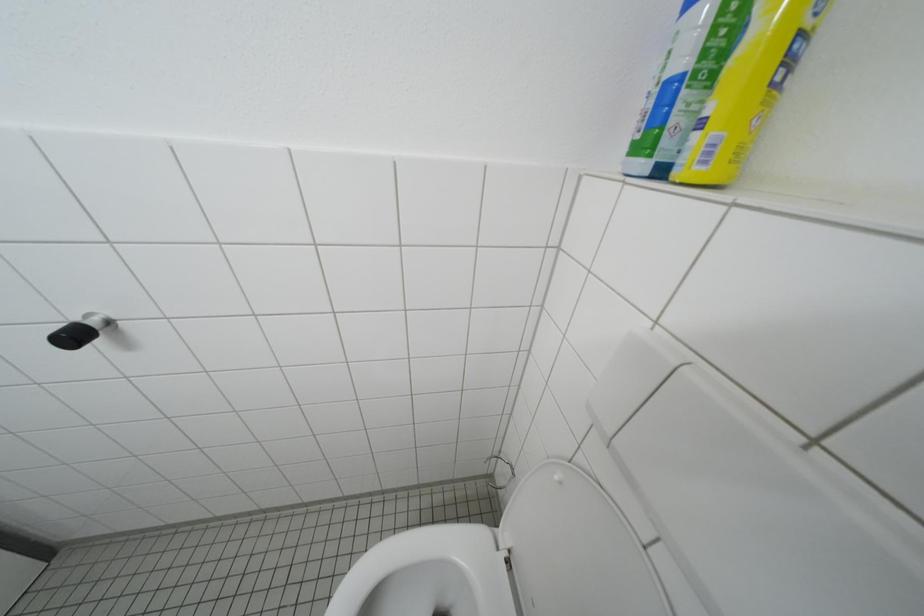
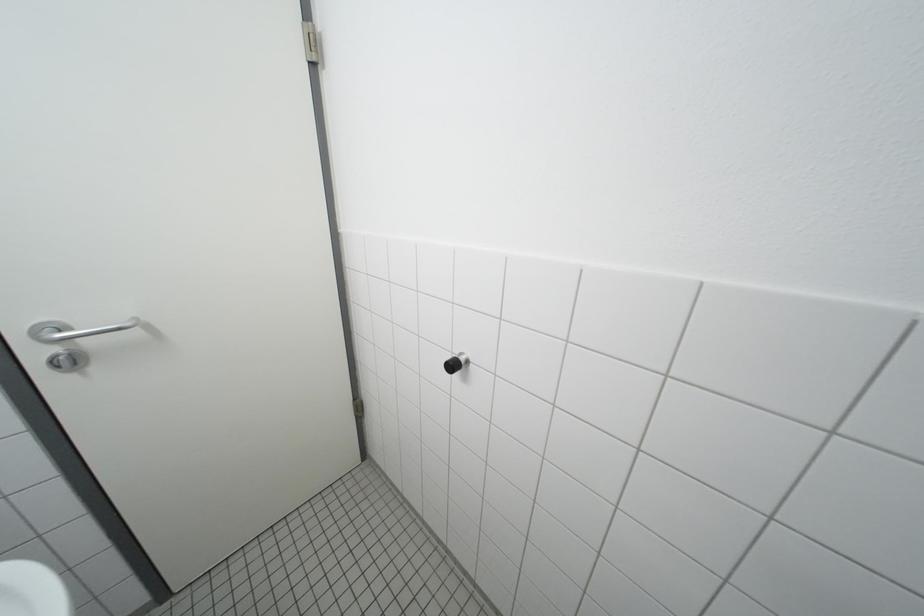
Question: Based on the continuous images, in which direction is the camera rotating? Reply with the corresponding letter.

Choices:
 (A) Left
 (B) Right
 (C) Up
 (D) Down

Answer: (A)